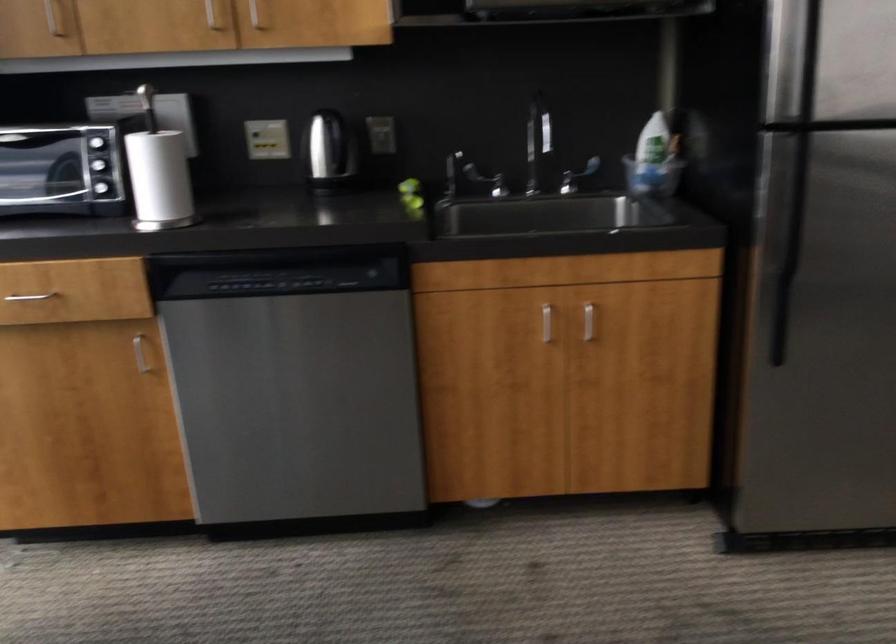
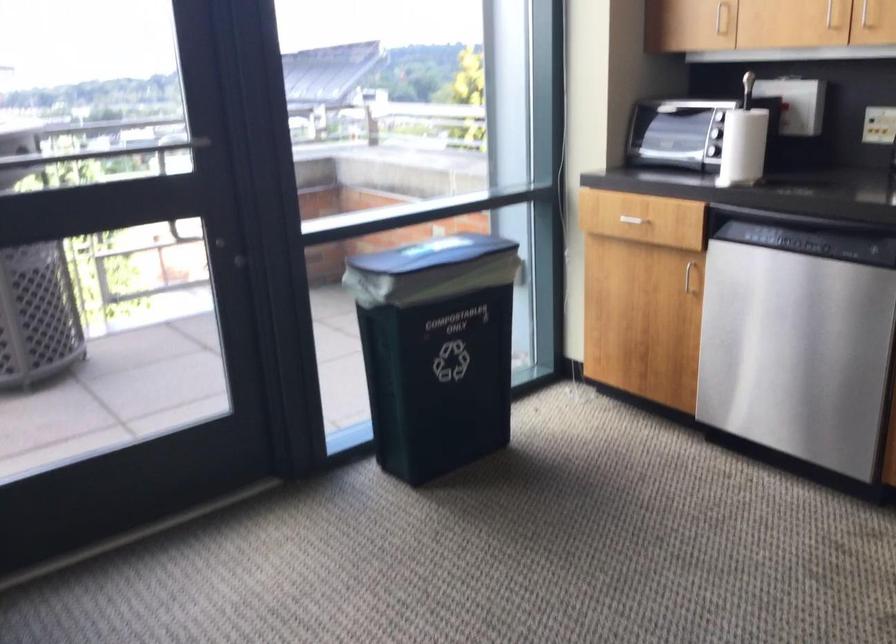
The point at [176,178] is marked in the first image. Where is the corresponding point in the second image?

(743, 146)